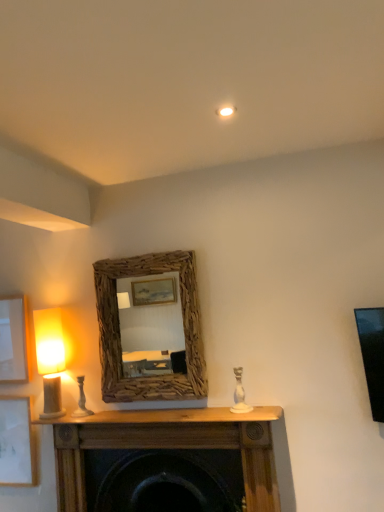
Question: Should I look upward or downward to see matte beige lampshade at left?

Choices:
 (A) down
 (B) up

Answer: (A)

Question: From the image's perspective, is white ceramic candle holder at left, the first candle holder in the left-to-right sequence, on white ceramic candle holder at center, acting as the second candle holder starting from the back?

Choices:
 (A) no
 (B) yes

Answer: (A)

Question: Is white ceramic candle holder at left, the first candle holder in the left-to-right sequence, aimed at white ceramic candle holder at center, arranged as the first candle holder when viewed from the right?

Choices:
 (A) yes
 (B) no

Answer: (B)

Question: Is white ceramic candle holder at left, positioned as the second candle holder in right-to-left order, not close to white ceramic candle holder at center, acting as the second candle holder starting from the back?

Choices:
 (A) no
 (B) yes

Answer: (A)

Question: Are white ceramic candle holder at left, the first candle holder in the left-to-right sequence, and white ceramic candle holder at center, which is counted as the 2th candle holder, starting from the left, making contact?

Choices:
 (A) yes
 (B) no

Answer: (B)

Question: Is white ceramic candle holder at left, placed as the 1th candle holder when sorted from back to front, thinner than white ceramic candle holder at center, acting as the second candle holder starting from the back?

Choices:
 (A) yes
 (B) no

Answer: (A)

Question: Is white ceramic candle holder at left, positioned as the second candle holder in right-to-left order, bigger than white ceramic candle holder at center, arranged as the first candle holder when viewed from the right?

Choices:
 (A) yes
 (B) no

Answer: (B)

Question: From a real-world perspective, is matte beige lampshade at left on white ceramic candle holder at left, marked as the 2th candle holder in a front-to-back arrangement?

Choices:
 (A) yes
 (B) no

Answer: (A)

Question: From the image's perspective, is matte beige lampshade at left on top of white ceramic candle holder at left, placed as the 1th candle holder when sorted from back to front?

Choices:
 (A) no
 (B) yes

Answer: (B)

Question: Considering the relative sizes of matte beige lampshade at left and white ceramic candle holder at left, positioned as the second candle holder in right-to-left order, in the image provided, is matte beige lampshade at left shorter than white ceramic candle holder at left, positioned as the second candle holder in right-to-left order,?

Choices:
 (A) no
 (B) yes

Answer: (A)

Question: Would you consider matte beige lampshade at left to be distant from white ceramic candle holder at left, positioned as the second candle holder in right-to-left order?

Choices:
 (A) no
 (B) yes

Answer: (A)

Question: From the image's perspective, is matte beige lampshade at left below white ceramic candle holder at left, marked as the 2th candle holder in a front-to-back arrangement?

Choices:
 (A) no
 (B) yes

Answer: (A)

Question: Considering the relative sizes of matte beige lampshade at left and white ceramic candle holder at left, the first candle holder in the left-to-right sequence, in the image provided, is matte beige lampshade at left taller than white ceramic candle holder at left, the first candle holder in the left-to-right sequence,?

Choices:
 (A) yes
 (B) no

Answer: (A)

Question: Is white ceramic candle holder at center, which is counted as the 2th candle holder, starting from the left, wider than white matte picture frame at lower left, which is the 1th picture frame from bottom to top?

Choices:
 (A) no
 (B) yes

Answer: (B)